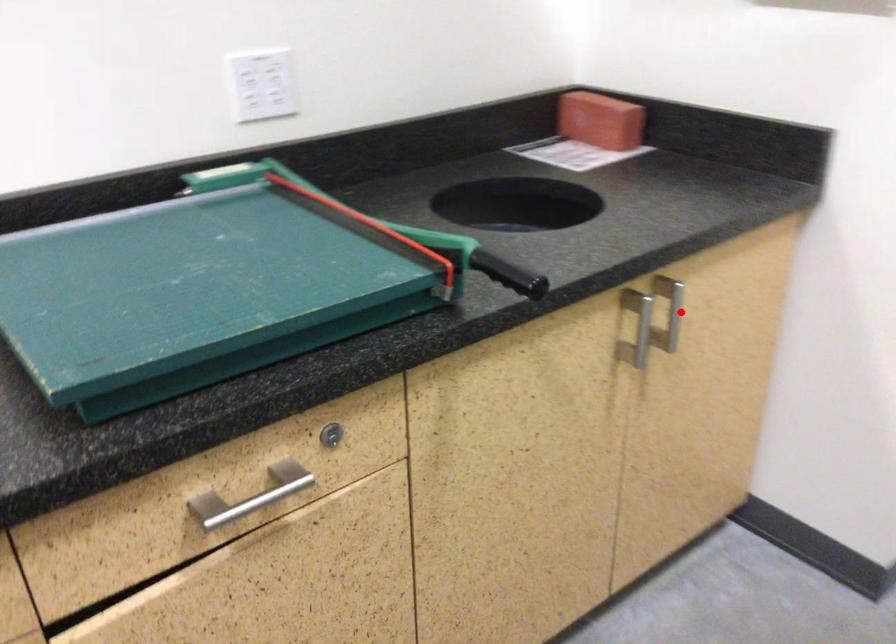
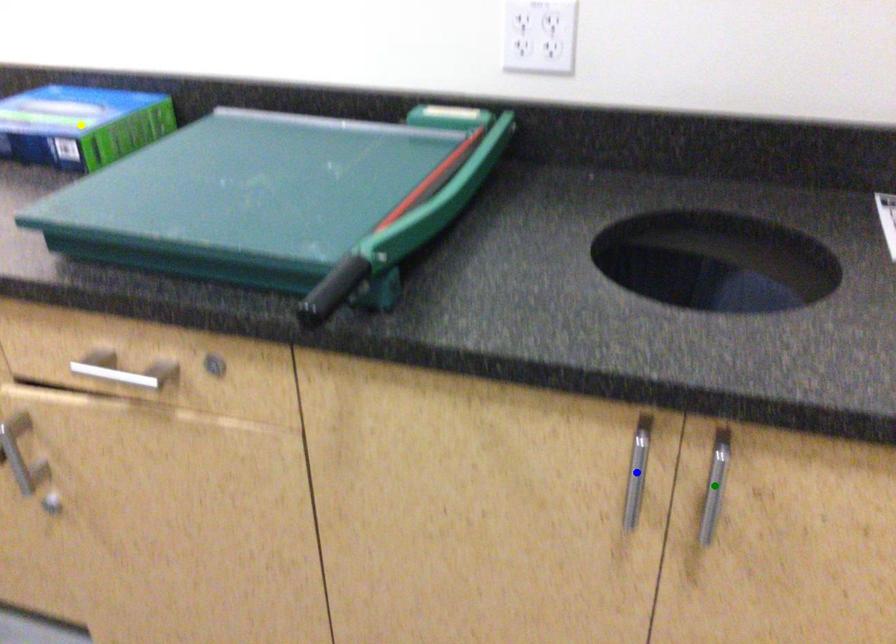
Question: I am providing you with two images of the same scene from different viewpoints. A red point is marked on the first image. You are given multiple points on the second image. Which point in image 2 is actually the same real-world point as the red point in image 1?

Choices:
 (A) green point
 (B) yellow point
 (C) blue point

Answer: (A)